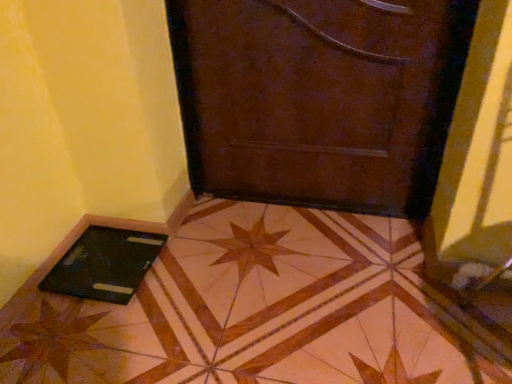
You are a GUI agent. You are given a task and a screenshot of the screen. Output one action in this format:
    pyautogui.click(x=<x>, y=<y>)
    Task: Click on the free spot above black glossy laptop at lower left (from a real-world perspective)
    
    Given the screenshot: What is the action you would take?
    pyautogui.click(x=247, y=302)